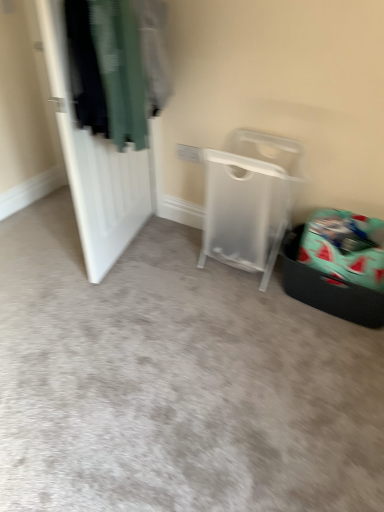
Question: Is transparent plastic laundry basket at center outside teal fabric laundry basket at lower right?

Choices:
 (A) no
 (B) yes

Answer: (B)

Question: Can you confirm if transparent plastic laundry basket at center is shorter than teal fabric laundry basket at lower right?

Choices:
 (A) no
 (B) yes

Answer: (A)

Question: Is transparent plastic laundry basket at center closer to camera compared to teal fabric laundry basket at lower right?

Choices:
 (A) yes
 (B) no

Answer: (A)

Question: Does transparent plastic laundry basket at center have a greater height compared to teal fabric laundry basket at lower right?

Choices:
 (A) yes
 (B) no

Answer: (A)

Question: Is the surface of transparent plastic laundry basket at center in direct contact with teal fabric laundry basket at lower right?

Choices:
 (A) yes
 (B) no

Answer: (B)

Question: Is point (89, 240) positioned closer to the camera than point (168, 234)?

Choices:
 (A) closer
 (B) farther

Answer: (A)

Question: Considering the positions of white matte door at left and transparent plastic trash bin at right in the image, is white matte door at left wider or thinner than transparent plastic trash bin at right?

Choices:
 (A) thin
 (B) wide

Answer: (A)

Question: Is white matte door at left spatially inside transparent plastic trash bin at right, or outside of it?

Choices:
 (A) inside
 (B) outside

Answer: (B)

Question: From the image's perspective, is white matte door at left positioned above or below transparent plastic trash bin at right?

Choices:
 (A) below
 (B) above

Answer: (B)

Question: Considering the positions of transparent plastic trash bin at right and white matte door at left in the image, is transparent plastic trash bin at right bigger or smaller than white matte door at left?

Choices:
 (A) big
 (B) small

Answer: (A)

Question: From the image's perspective, is transparent plastic trash bin at right positioned above or below white matte door at left?

Choices:
 (A) above
 (B) below

Answer: (B)

Question: In terms of height, does transparent plastic trash bin at right look taller or shorter compared to white matte door at left?

Choices:
 (A) tall
 (B) short

Answer: (B)

Question: Is transparent plastic trash bin at right wider or thinner than white matte door at left?

Choices:
 (A) thin
 (B) wide

Answer: (B)

Question: In terms of height, does teal fabric laundry basket at lower right look taller or shorter compared to white matte door at left?

Choices:
 (A) tall
 (B) short

Answer: (B)

Question: Based on their sizes in the image, would you say teal fabric laundry basket at lower right is bigger or smaller than white matte door at left?

Choices:
 (A) small
 (B) big

Answer: (A)